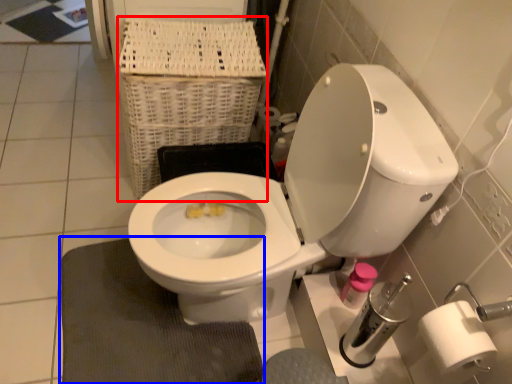
Question: Which point is further to the camera, basket (highlighted by a red box) or bath mat (highlighted by a blue box)?

Choices:
 (A) basket
 (B) bath mat

Answer: (A)